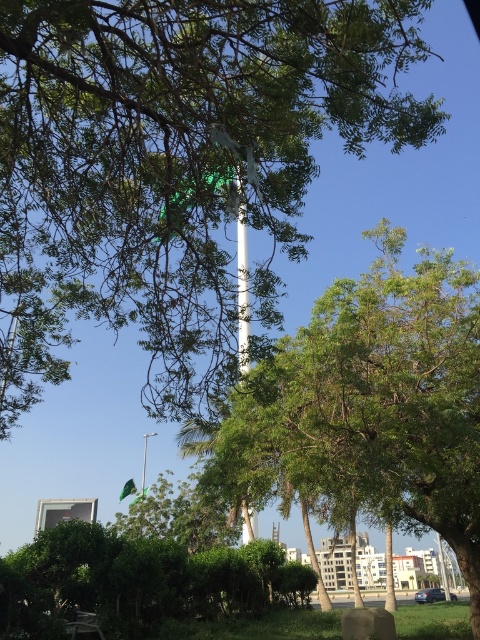
You are standing at the point with coordinates point [204,200] and want to walk to the point with coordinates point [252,374]. Based on the scene description, will you have an unobstructed path to reach your destination?

Since point [204,200] is in front of point [252,374], you will have an unobstructed path to reach your destination because the starting point is closer to the viewer, meaning the destination point is behind it and not blocked by any objects in between.

You are a pedestrian standing at the edge of the road and see the white glossy pole at center and the green fabric flag at center. Which object is closer to your right side?

The white glossy pole at center is to the right of the green fabric flag at center, so the white glossy pole at center is closer to your right side.